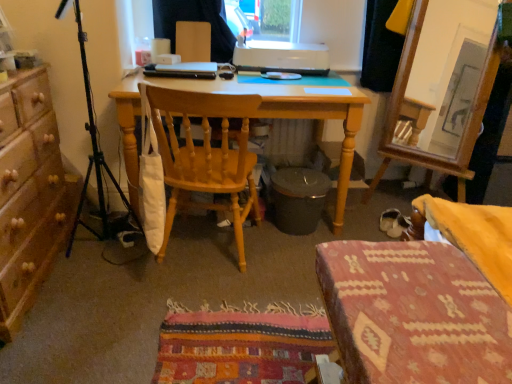
Question: Does wooden chair at center come in front of white suede shoe at lower right?

Choices:
 (A) yes
 (B) no

Answer: (A)

Question: Does wooden chair at center have a greater width compared to white suede shoe at lower right?

Choices:
 (A) no
 (B) yes

Answer: (B)

Question: Considering the relative sizes of wooden chair at center and white suede shoe at lower right in the image provided, is wooden chair at center thinner than white suede shoe at lower right?

Choices:
 (A) no
 (B) yes

Answer: (A)

Question: Is wooden chair at center shorter than white suede shoe at lower right?

Choices:
 (A) no
 (B) yes

Answer: (A)

Question: Is wooden chair at center positioned beyond the bounds of white suede shoe at lower right?

Choices:
 (A) no
 (B) yes

Answer: (B)

Question: Based on their sizes in the image, would you say black matte tripod at left is bigger or smaller than textured woolen stool at lower right?

Choices:
 (A) big
 (B) small

Answer: (A)

Question: Is black matte tripod at left wider or thinner than textured woolen stool at lower right?

Choices:
 (A) wide
 (B) thin

Answer: (B)

Question: Is point (126, 200) closer or farther from the camera than point (492, 329)?

Choices:
 (A) closer
 (B) farther

Answer: (B)

Question: Is black matte tripod at left in front of or behind textured woolen stool at lower right in the image?

Choices:
 (A) front
 (B) behind

Answer: (B)

Question: From a real-world perspective, is white plastic printer at upper center positioned above or below black matte laptop at center?

Choices:
 (A) below
 (B) above

Answer: (B)

Question: From the image's perspective, is white plastic printer at upper center positioned above or below black matte laptop at center?

Choices:
 (A) below
 (B) above

Answer: (B)

Question: Is white plastic printer at upper center in front of or behind black matte laptop at center in the image?

Choices:
 (A) behind
 (B) front

Answer: (A)

Question: Is white plastic printer at upper center situated inside black matte laptop at center or outside?

Choices:
 (A) outside
 (B) inside

Answer: (A)

Question: In terms of height, does black matte tripod at left look taller or shorter compared to white suede shoe at lower right?

Choices:
 (A) short
 (B) tall

Answer: (B)

Question: Based on their sizes in the image, would you say black matte tripod at left is bigger or smaller than white suede shoe at lower right?

Choices:
 (A) small
 (B) big

Answer: (B)